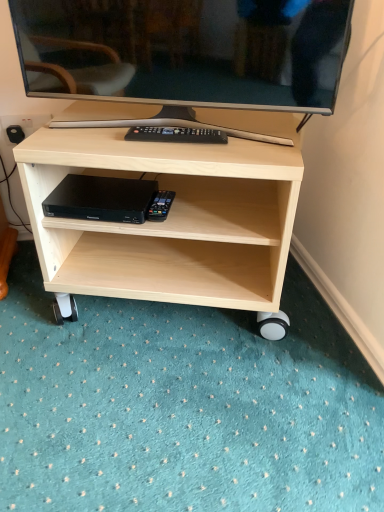
Question: Is black plastic dvd player at lower center completely or partially outside of matte black television at upper center?

Choices:
 (A) no
 (B) yes

Answer: (B)

Question: Is black plastic dvd player at lower center to the right of matte black television at upper center from the viewer's perspective?

Choices:
 (A) no
 (B) yes

Answer: (A)

Question: Is black plastic dvd player at lower center not close to matte black television at upper center?

Choices:
 (A) no
 (B) yes

Answer: (A)

Question: From a real-world perspective, is black plastic dvd player at lower center on matte black television at upper center?

Choices:
 (A) no
 (B) yes

Answer: (A)

Question: Does black plastic dvd player at lower center turn towards matte black television at upper center?

Choices:
 (A) no
 (B) yes

Answer: (A)

Question: Is black plastic dvd player at lower center behind matte black television at upper center?

Choices:
 (A) yes
 (B) no

Answer: (A)

Question: Is black plastic dvd player at lower center closer to camera compared to light wood shelf at center?

Choices:
 (A) no
 (B) yes

Answer: (A)

Question: Does black plastic dvd player at lower center have a greater width compared to light wood shelf at center?

Choices:
 (A) yes
 (B) no

Answer: (B)

Question: From the image's perspective, is black plastic dvd player at lower center under light wood shelf at center?

Choices:
 (A) yes
 (B) no

Answer: (B)

Question: Is the depth of black plastic dvd player at lower center greater than that of light wood shelf at center?

Choices:
 (A) yes
 (B) no

Answer: (A)

Question: From the image's perspective, is black plastic dvd player at lower center on top of light wood shelf at center?

Choices:
 (A) no
 (B) yes

Answer: (B)

Question: Can you see black plastic dvd player at lower center touching light wood shelf at center?

Choices:
 (A) yes
 (B) no

Answer: (B)

Question: Is matte black television at upper center taller than black plastic dvd player at lower center?

Choices:
 (A) yes
 (B) no

Answer: (A)